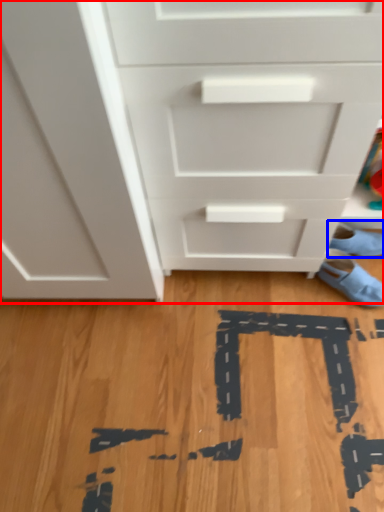
Question: Which object is further to the camera taking this photo, chest of drawers (highlighted by a red box) or footwear (highlighted by a blue box)?

Choices:
 (A) chest of drawers
 (B) footwear

Answer: (B)